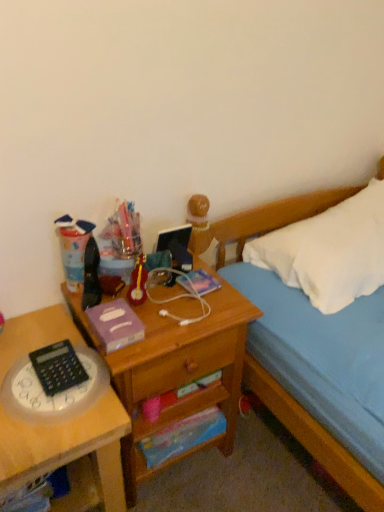
Question: In which direction should I rotate to look at blue paper at lower center, the 3th paperback book viewed from the top?

Choices:
 (A) right
 (B) left

Answer: (B)

Question: Considering the relative sizes of translucent plastic clock at left, which appears as the 2th desk when viewed from the right, and wooden drawer at center in the image provided, is translucent plastic clock at left, which appears as the 2th desk when viewed from the right, wider than wooden drawer at center?

Choices:
 (A) no
 (B) yes

Answer: (B)

Question: From the image's perspective, is translucent plastic clock at left, the 1th desk in the left-to-right sequence, below wooden drawer at center?

Choices:
 (A) no
 (B) yes

Answer: (B)

Question: Is translucent plastic clock at left, the 1th desk in the left-to-right sequence, aimed at wooden drawer at center?

Choices:
 (A) no
 (B) yes

Answer: (A)

Question: Is the position of translucent plastic clock at left, the 1th desk in the left-to-right sequence, more distant than that of wooden drawer at center?

Choices:
 (A) no
 (B) yes

Answer: (A)

Question: Is wooden drawer at center a part of translucent plastic clock at left, which appears as the 2th desk when viewed from the right?

Choices:
 (A) no
 (B) yes

Answer: (A)

Question: From a real-world perspective, is translucent plastic clock at left, which appears as the 2th desk when viewed from the right, over wooden drawer at center?

Choices:
 (A) no
 (B) yes

Answer: (A)

Question: Does translucent plastic clock at lower left have a lesser width compared to wooden drawer at center?

Choices:
 (A) no
 (B) yes

Answer: (A)

Question: Does translucent plastic clock at lower left appear on the right side of wooden drawer at center?

Choices:
 (A) no
 (B) yes

Answer: (A)

Question: Is translucent plastic clock at lower left shorter than wooden drawer at center?

Choices:
 (A) yes
 (B) no

Answer: (A)

Question: Does translucent plastic clock at lower left have a larger size compared to wooden drawer at center?

Choices:
 (A) no
 (B) yes

Answer: (A)

Question: Is translucent plastic clock at lower left facing towards wooden drawer at center?

Choices:
 (A) yes
 (B) no

Answer: (B)

Question: Does translucent plastic clock at lower left have a greater height compared to wooden drawer at center?

Choices:
 (A) no
 (B) yes

Answer: (A)

Question: Is purple matte paper at center, which is the second paperback book from top to bottom, in front of metallic purple paperback book at center, acting as the third paperback book starting from the bottom?

Choices:
 (A) no
 (B) yes

Answer: (B)